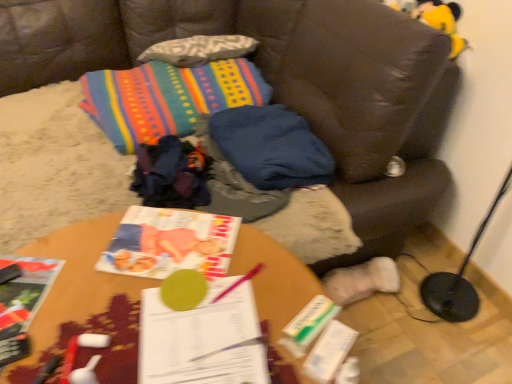
Question: Should I look upward or downward to see matte paper book at center, the second book viewed from the left?

Choices:
 (A) up
 (B) down

Answer: (B)

Question: From a real-world perspective, is blue fabric pillow at center located beneath matte paper book at center, which is counted as the 2th book, starting from the right?

Choices:
 (A) no
 (B) yes

Answer: (B)

Question: Is blue fabric pillow at center to the right of matte paper book at center, which is counted as the 2th book, starting from the right, from the viewer's perspective?

Choices:
 (A) no
 (B) yes

Answer: (B)

Question: Considering the relative sizes of blue fabric pillow at center and matte paper book at center, the second book viewed from the left, in the image provided, is blue fabric pillow at center thinner than matte paper book at center, the second book viewed from the left,?

Choices:
 (A) no
 (B) yes

Answer: (A)

Question: From the image's perspective, does blue fabric pillow at center appear higher than matte paper book at center, the second book viewed from the left?

Choices:
 (A) no
 (B) yes

Answer: (B)

Question: Is blue fabric pillow at center shorter than matte paper book at center, the second book viewed from the left?

Choices:
 (A) no
 (B) yes

Answer: (A)

Question: Is blue fabric pillow at center looking in the opposite direction of matte paper book at center, which is counted as the 2th book, starting from the right?

Choices:
 (A) no
 (B) yes

Answer: (A)

Question: From the image's perspective, is white paper book at center, which is the first book in right-to-left order, over wooden table at center?

Choices:
 (A) yes
 (B) no

Answer: (A)

Question: Is the depth of white paper book at center, the 3th book positioned from the left, greater than that of wooden table at center?

Choices:
 (A) no
 (B) yes

Answer: (B)

Question: From a real-world perspective, is white paper book at center, the 3th book positioned from the left, positioned over wooden table at center based on gravity?

Choices:
 (A) yes
 (B) no

Answer: (A)

Question: Are white paper book at center, which is the first book in right-to-left order, and wooden table at center beside each other?

Choices:
 (A) yes
 (B) no

Answer: (A)

Question: Considering the relative sizes of white paper book at center, the 3th book positioned from the left, and wooden table at center in the image provided, is white paper book at center, the 3th book positioned from the left, smaller than wooden table at center?

Choices:
 (A) yes
 (B) no

Answer: (A)

Question: Is wooden table at center behind multicolored woven blanket at upper center?

Choices:
 (A) yes
 (B) no

Answer: (B)